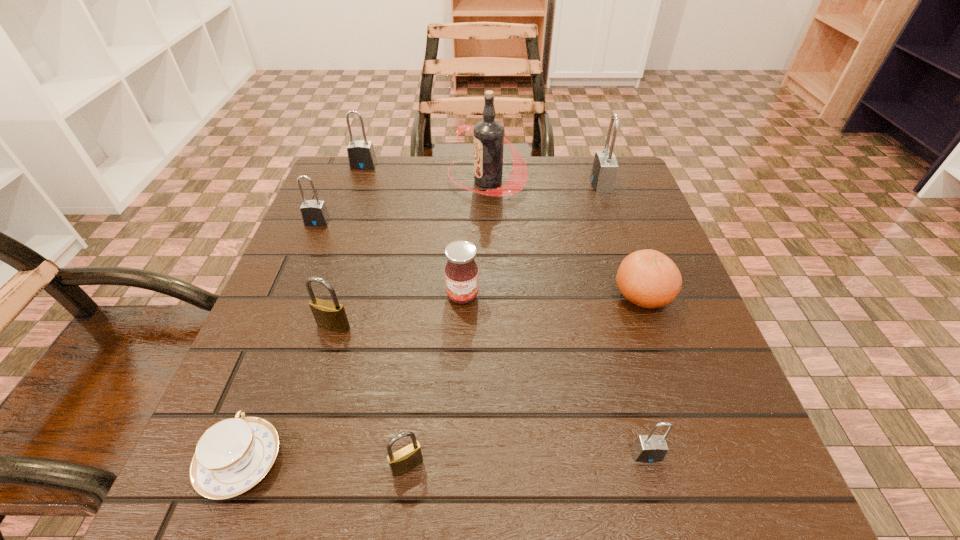
The width and height of the screenshot is (960, 540). Find the location of `clementine`. clementine is located at coordinates (648, 278).

At what (x,y) coordinates should I click in order to perform the action: click on the third gray padlock from left to right. Please return your answer as a coordinate pair (x, y). This screenshot has height=540, width=960. Looking at the image, I should click on tap(650, 448).

Where is `the smallest gray padlock`? The width and height of the screenshot is (960, 540). the smallest gray padlock is located at coordinates (650, 448).

This screenshot has width=960, height=540. Find the location of `the nearer brass padlock`. the nearer brass padlock is located at coordinates (406, 458).

Identify the location of the third padlock from right to left. Image resolution: width=960 pixels, height=540 pixels. (406, 458).

This screenshot has width=960, height=540. What are the coordinates of `blue teacup` in the screenshot? It's located at (233, 455).

This screenshot has width=960, height=540. In order to click on the shortest object in this screenshot , I will do `click(233, 455)`.

This screenshot has width=960, height=540. I want to click on free location located on the label of the tallest object, so click(x=344, y=181).

Image resolution: width=960 pixels, height=540 pixels. What are the coordinates of `free spot located on the label of the tallest object` in the screenshot? It's located at (324, 181).

Find the location of `vacant area situated on the label of the tallest object`. vacant area situated on the label of the tallest object is located at coordinates (364, 181).